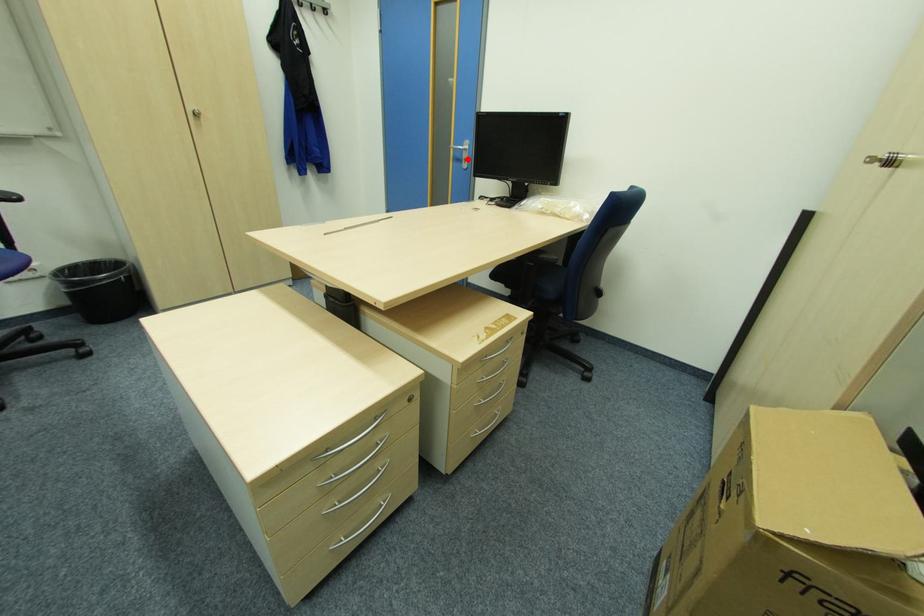
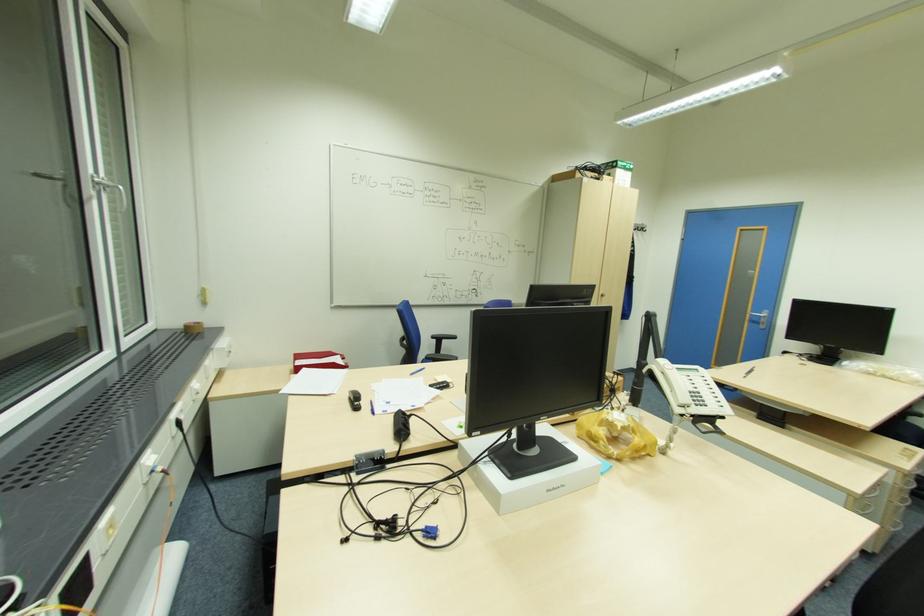
Question: I am providing you with two images of the same scene from different viewpoints. In image1, a red point is highlighted. Considering the same 3D point in image2, which of the following is correct?

Choices:
 (A) It is closer
 (B) It is farther

Answer: (B)